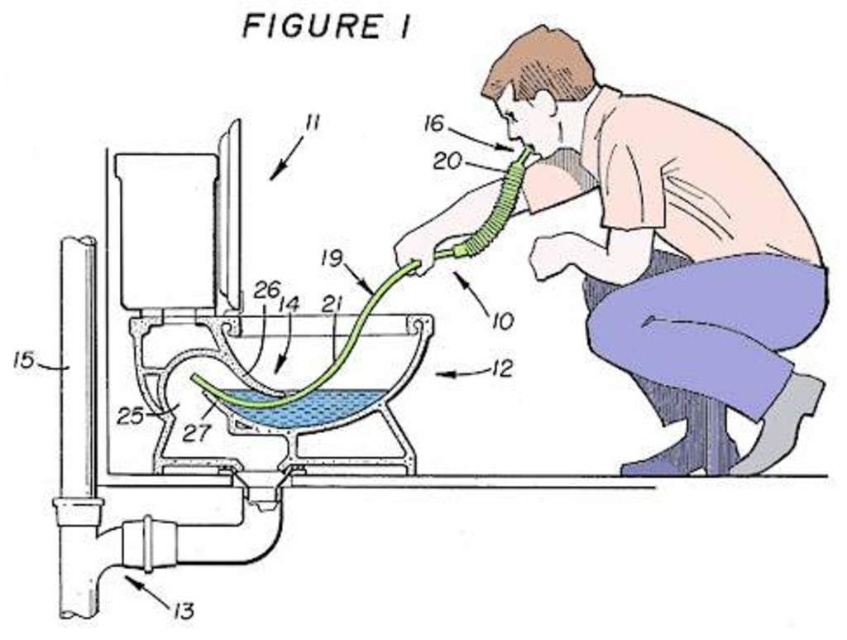
You are a technician trying to access the green rubber hose at center while avoiding contact with the pink fabric shirt at upper right. Based on the figure, what is the minimum distance you need to maintain between the two?

The minimum distance you need to maintain between the pink fabric shirt at upper right and the green rubber hose at center is 28.01 inches to avoid contact.

You are a repair technician looking at the cross section of the toilet in the image. You need to determine the relative height of the pink fabric shirt at upper right and the green rubber hose at center. Which one is taller?

The pink fabric shirt at upper right is much taller than the green rubber hose at center according to the description.